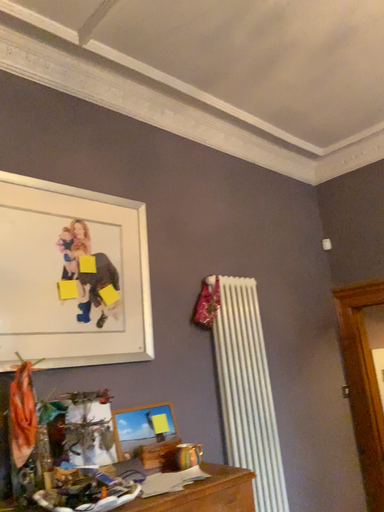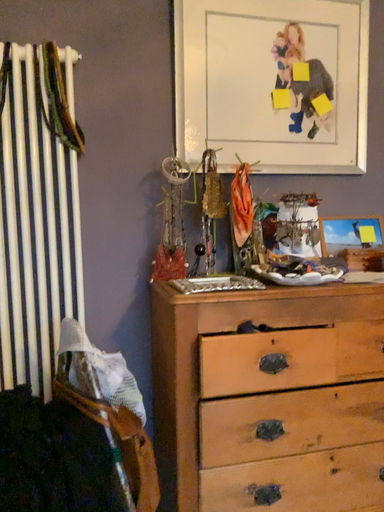
Question: Which way did the camera rotate in the video?

Choices:
 (A) rotated upward
 (B) rotated downward

Answer: (B)